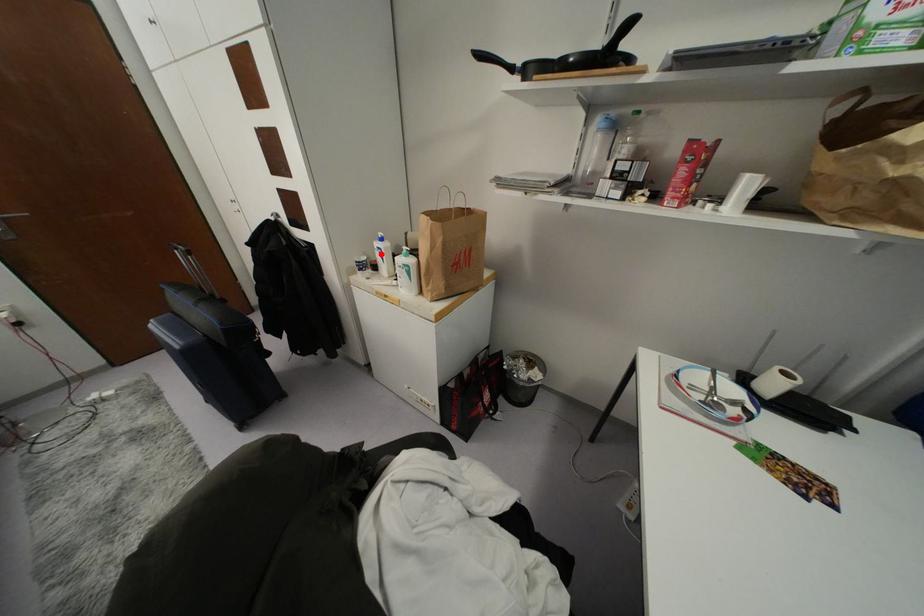
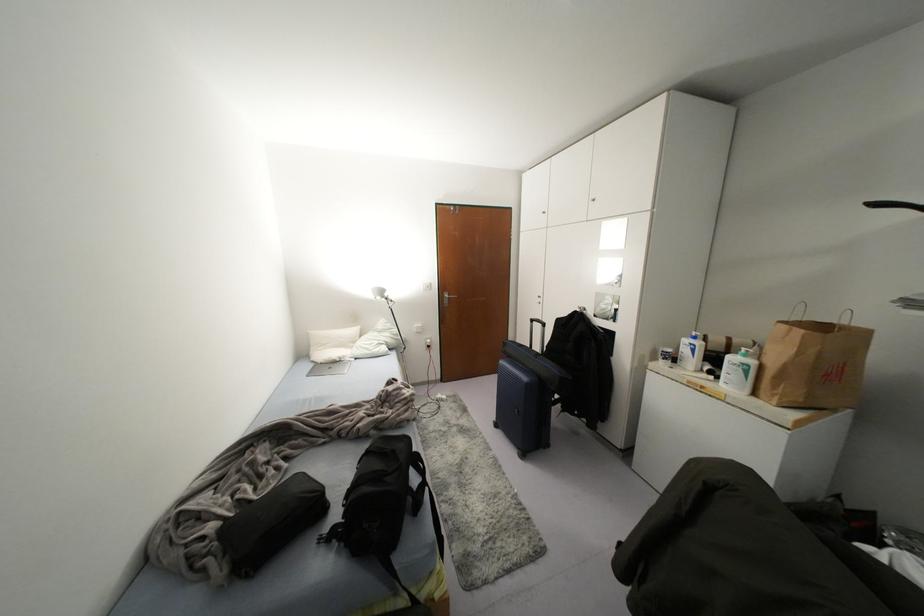
In the second image, find the point that corresponds to the highlighted location in the first image.

(691, 350)